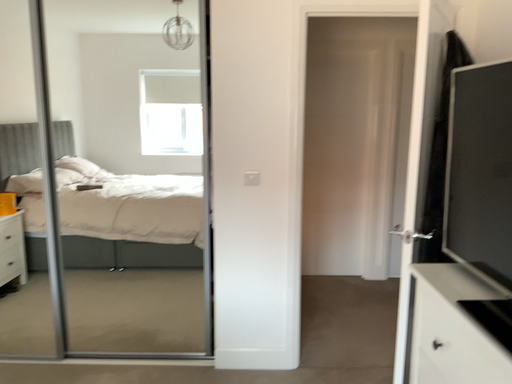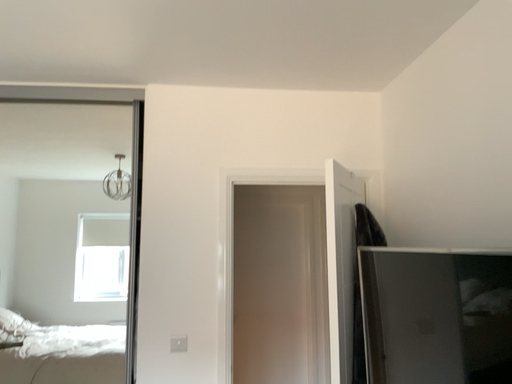
Question: Which way did the camera rotate in the video?

Choices:
 (A) rotated upward
 (B) rotated downward

Answer: (A)